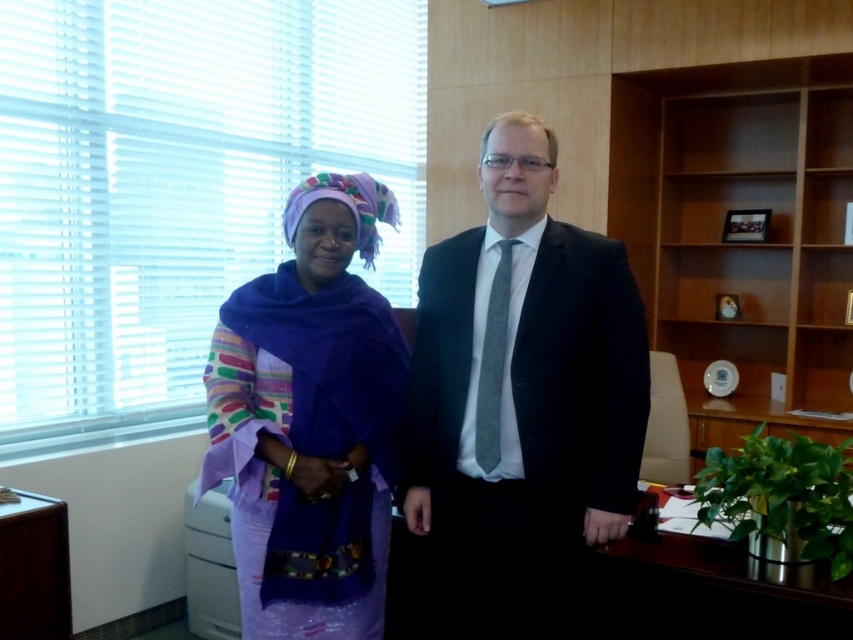
Question: Among these points, which one is farthest from the camera?

Choices:
 (A) (508, 280)
 (B) (833, 244)
 (C) (238, 444)

Answer: (B)

Question: Based on their relative distances, which object is nearer to the purple fabric at left?

Choices:
 (A) matte black suit at center
 (B) light brown wood bookshelf at right

Answer: (A)

Question: Does light brown wood bookshelf at right have a lesser width compared to purple fabric at left?

Choices:
 (A) no
 (B) yes

Answer: (A)

Question: Which point appears farthest from the camera in this image?

Choices:
 (A) click(x=228, y=324)
 (B) click(x=751, y=68)
 (C) click(x=529, y=454)

Answer: (B)

Question: Is light brown wood bookshelf at right bigger than purple fabric at left?

Choices:
 (A) no
 (B) yes

Answer: (B)

Question: Is matte black suit at center thinner than light brown wood bookshelf at right?

Choices:
 (A) yes
 (B) no

Answer: (A)